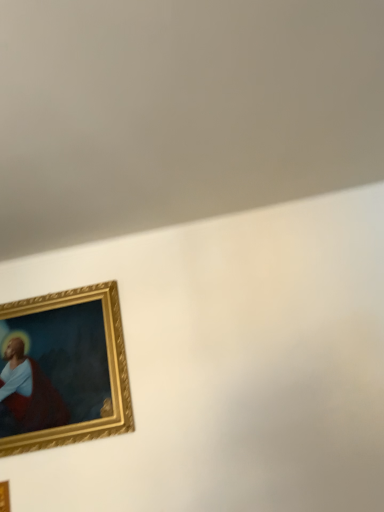
Question: From a real-world perspective, is gold wooden picture frame at lower left, positioned as the second picture frame in back-to-front order, physically located above or below gold/gilded picture frame at lower left, which is counted as the first picture frame, starting from the top?

Choices:
 (A) below
 (B) above

Answer: (A)

Question: From the image's perspective, is gold wooden picture frame at lower left, the first picture frame in the bottom-to-top sequence, above or below gold/gilded picture frame at lower left, the 2th picture frame positioned from the front?

Choices:
 (A) below
 (B) above

Answer: (A)

Question: Choose the correct answer: Is gold wooden picture frame at lower left, positioned as the second picture frame in back-to-front order, inside gold/gilded picture frame at lower left, marked as the second picture frame in a bottom-to-top arrangement, or outside it?

Choices:
 (A) inside
 (B) outside

Answer: (B)

Question: In terms of height, does gold/gilded picture frame at lower left, which is counted as the first picture frame, starting from the top, look taller or shorter compared to gold wooden picture frame at lower left, which ranks as the 2th picture frame in top-to-bottom order?

Choices:
 (A) short
 (B) tall

Answer: (B)

Question: From the image's perspective, is gold/gilded picture frame at lower left, the 2th picture frame positioned from the front, above or below gold wooden picture frame at lower left, which ranks as the 2th picture frame in top-to-bottom order?

Choices:
 (A) below
 (B) above

Answer: (B)

Question: Is gold/gilded picture frame at lower left, which is counted as the first picture frame, starting from the top, inside or outside of gold wooden picture frame at lower left, the first picture frame in the bottom-to-top sequence?

Choices:
 (A) outside
 (B) inside

Answer: (A)

Question: From a real-world perspective, is gold/gilded picture frame at lower left, the 2th picture frame positioned from the front, physically located above or below gold wooden picture frame at lower left, positioned as the second picture frame in back-to-front order?

Choices:
 (A) below
 (B) above

Answer: (B)